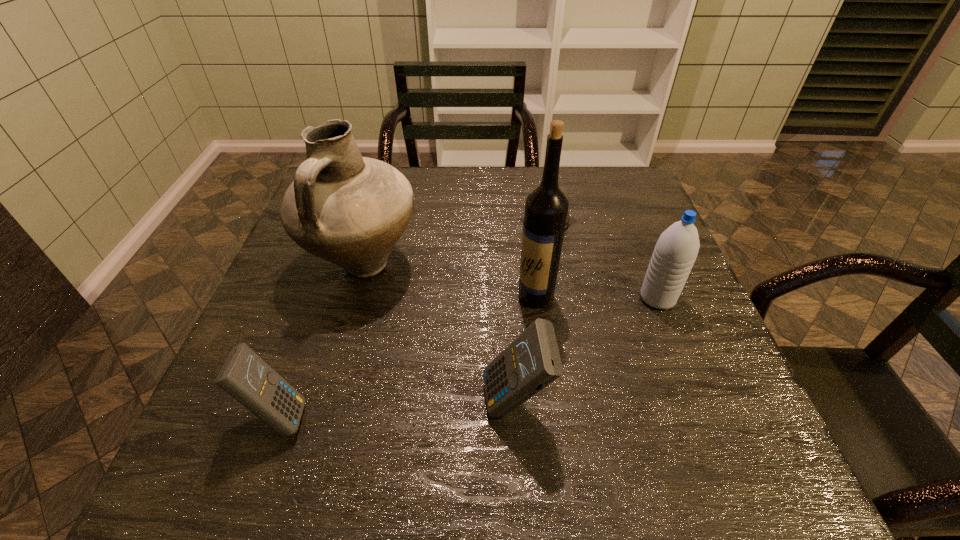
At what (x,y) coordinates should I click in order to perform the action: click on calculator that is at the left edge. Please return your answer as a coordinate pair (x, y). This screenshot has height=540, width=960. Looking at the image, I should click on (244, 375).

You are a GUI agent. You are given a task and a screenshot of the screen. Output one action in this format:
    pyautogui.click(x=<x>, y=<y>)
    Task: Click on the pitcher that is at the left edge
    This screenshot has height=540, width=960.
    Given the screenshot: What is the action you would take?
    pyautogui.click(x=350, y=210)

You are a GUI agent. You are given a task and a screenshot of the screen. Output one action in this format:
    pyautogui.click(x=<x>, y=<y>)
    Task: Click on the object located at the right edge
    
    Given the screenshot: What is the action you would take?
    pyautogui.click(x=676, y=250)

Where is `object situated at the near left corner`? object situated at the near left corner is located at coordinates (244, 375).

Locate an element on the screen. The width and height of the screenshot is (960, 540). vacant space at the far edge of the desktop is located at coordinates (563, 168).

Where is `vacant region at the near edge`? The width and height of the screenshot is (960, 540). vacant region at the near edge is located at coordinates (518, 418).

The image size is (960, 540). In the image, there is a desktop. Identify the location of vacant space at the left edge. (291, 285).

Identify the location of vacant space at the right edge of the desktop. The height and width of the screenshot is (540, 960). (646, 234).

Where is `free space that is in between the chocolate cake and the fourth tallest object`? This screenshot has width=960, height=540. free space that is in between the chocolate cake and the fourth tallest object is located at coordinates (532, 312).

Identify the location of unoccupied position between the fifth shortest object and the fourth shortest object. (511, 281).